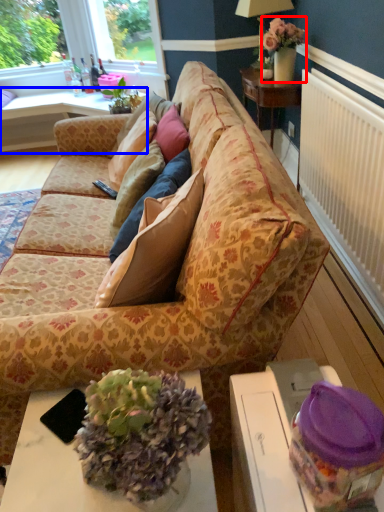
Question: Which object appears farthest to the camera in this image, houseplant (highlighted by a red box) or table (highlighted by a blue box)?

Choices:
 (A) houseplant
 (B) table

Answer: (B)